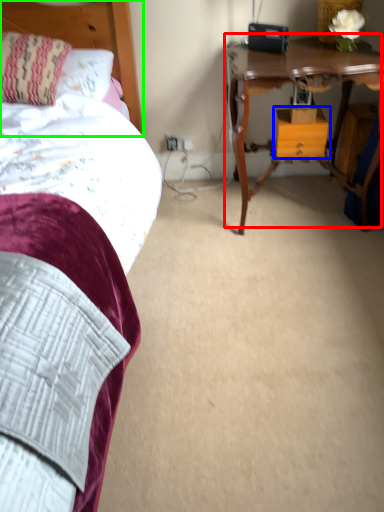
Question: Based on their relative distances, which object is farther from table (highlighted by a red box)? Choose from nightstand (highlighted by a blue box) and headboard (highlighted by a green box).

Choices:
 (A) nightstand
 (B) headboard

Answer: (B)